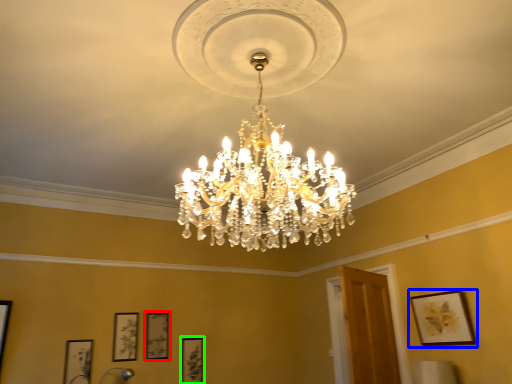
Question: Based on their relative distances, which object is farther from picture frame (highlighted by a red box)? Choose from picture frame (highlighted by a blue box) and picture frame (highlighted by a green box).

Choices:
 (A) picture frame
 (B) picture frame

Answer: (A)